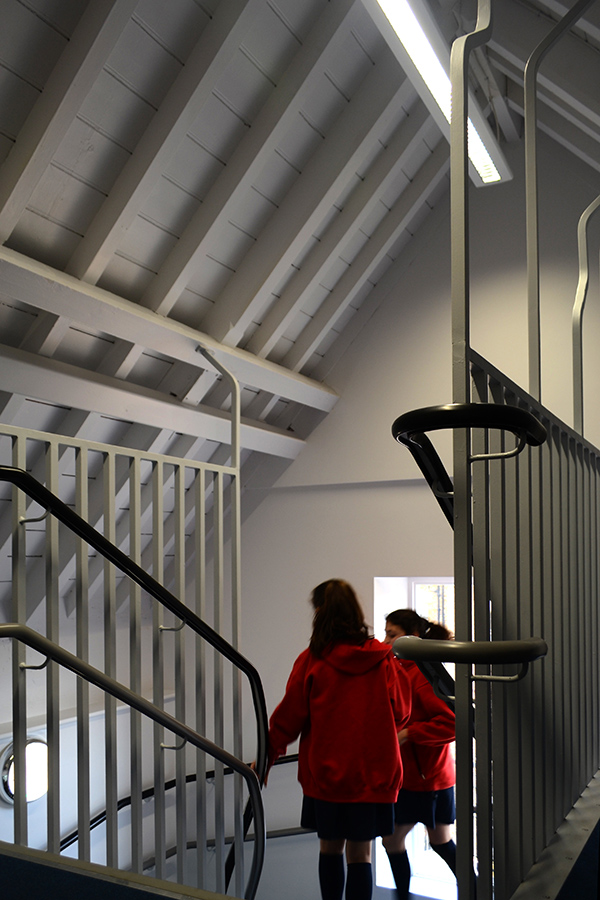
Find the location of a particular element. light is located at coordinates (434, 870).